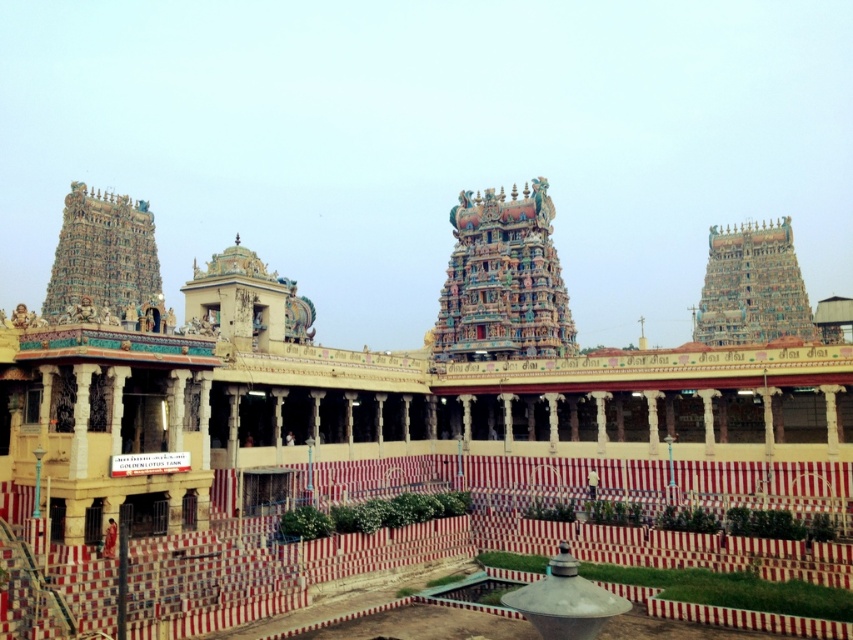
Question: Is multicolored ornate temple at center bigger than multicolored ornate temple tower at upper right?

Choices:
 (A) yes
 (B) no

Answer: (B)

Question: Which object appears closest to the camera in this image?

Choices:
 (A) multicolored carved temple tower at upper left
 (B) yellow painted stone palace at center

Answer: (B)

Question: Where is yellow painted stone palace at center located in relation to multicolored carved temple tower at upper left in the image?

Choices:
 (A) above
 (B) below

Answer: (A)

Question: Does multicolored ornate temple at center have a greater width compared to multicolored carved temple tower at upper left?

Choices:
 (A) no
 (B) yes

Answer: (A)

Question: Which object is positioned farthest from the multicolored carved temple tower at upper left?

Choices:
 (A) multicolored ornate temple at center
 (B) yellow painted stone palace at center
 (C) multicolored ornate temple tower at upper right

Answer: (C)

Question: Which object is positioned closest to the multicolored ornate temple tower at upper right?

Choices:
 (A) yellow painted stone palace at center
 (B) multicolored ornate temple at center

Answer: (A)